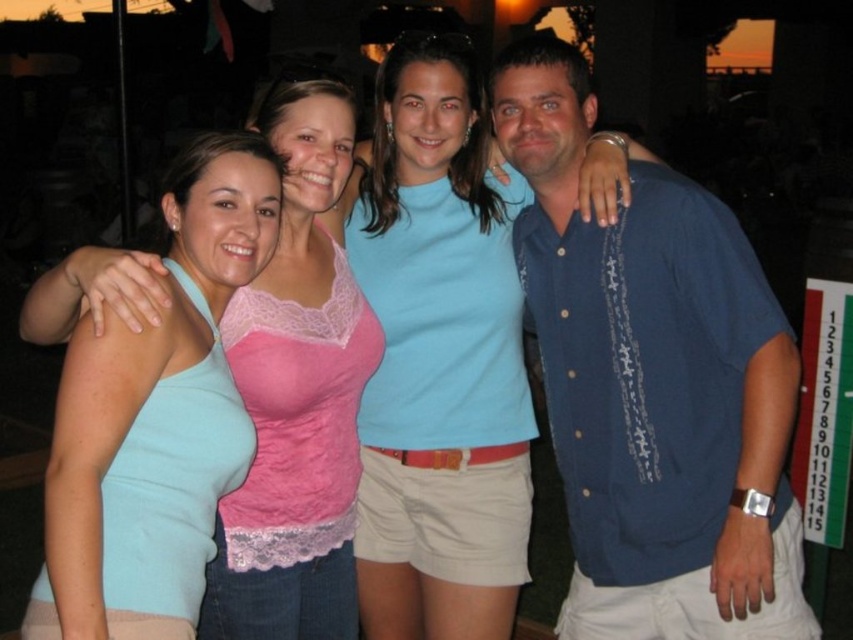
Question: Is the position of blue textured shirt at center more distant than that of light blue cotton shirt at center?

Choices:
 (A) no
 (B) yes

Answer: (A)

Question: Considering the relative positions of light blue cotton shirt at center and light blue tank top at left in the image provided, where is light blue cotton shirt at center located with respect to light blue tank top at left?

Choices:
 (A) below
 (B) above

Answer: (B)

Question: Which object is closer to the camera taking this photo?

Choices:
 (A) light blue tank top at left
 (B) light blue cotton shirt at center
 (C) blue textured shirt at center

Answer: (C)

Question: Where is light blue cotton shirt at center located in relation to light blue tank top at left in the image?

Choices:
 (A) above
 (B) below

Answer: (A)

Question: Which point appears closest to the camera in this image?

Choices:
 (A) (759, 634)
 (B) (419, 506)
 (C) (244, 636)

Answer: (A)

Question: Which point is farther from the camera taking this photo?

Choices:
 (A) (312, 380)
 (B) (643, 618)

Answer: (B)